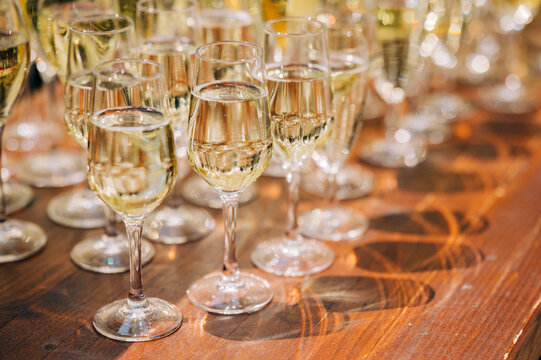
Find the location of `shadows of glasses on table`. shadows of glasses on table is located at coordinates (279, 324), (364, 296), (412, 261), (434, 226), (457, 184), (494, 152), (514, 127).